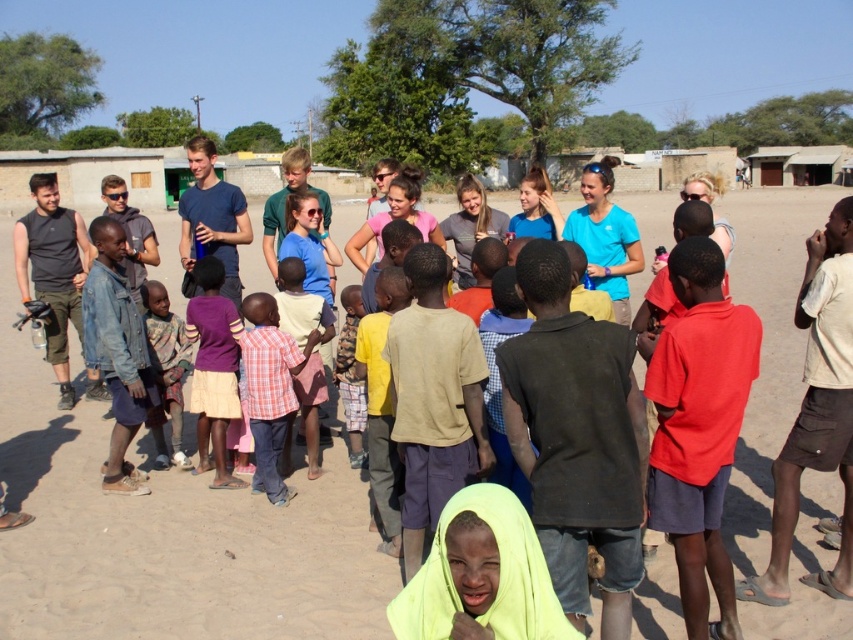
Between plaid shirt at center and knitted sweater at center, which one appears on the right side from the viewer's perspective?

plaid shirt at center

Measure the distance from plaid shirt at center to knitted sweater at center.

A distance of 36.27 inches exists between plaid shirt at center and knitted sweater at center.

Image resolution: width=853 pixels, height=640 pixels. Find the location of `plaid shirt at center`. plaid shirt at center is located at coordinates (270, 388).

The width and height of the screenshot is (853, 640). I want to click on plaid shirt at center, so pyautogui.click(x=270, y=388).

How distant is dirt field at center from purple fabric skirt at center?

3.57 meters

Based on the photo, between dirt field at center and purple fabric skirt at center, which one has less height?

With less height is purple fabric skirt at center.

Is point (45, 458) farther from viewer compared to point (204, 458)?

Yes, it is.

The height and width of the screenshot is (640, 853). In order to click on dirt field at center in this screenshot , I will do `click(167, 532)`.

Which is more to the left, purple fabric skirt at center or knitted sweater at center?

From the viewer's perspective, knitted sweater at center appears more on the left side.

Does point (225, 332) come closer to viewer compared to point (173, 392)?

Yes.

Image resolution: width=853 pixels, height=640 pixels. I want to click on purple fabric skirt at center, so click(x=213, y=369).